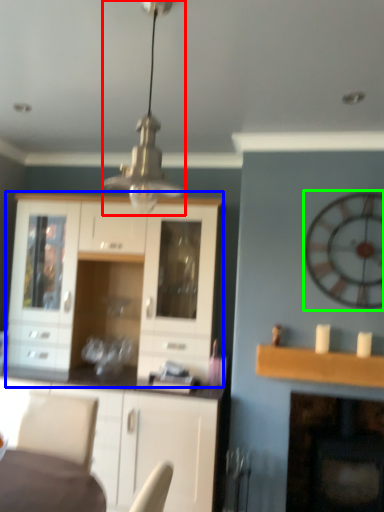
Question: Which object is the closest to the light fixture (highlighted by a red box)? Choose among these: cabinetry (highlighted by a blue box) or clock (highlighted by a green box).

Choices:
 (A) cabinetry
 (B) clock

Answer: (A)